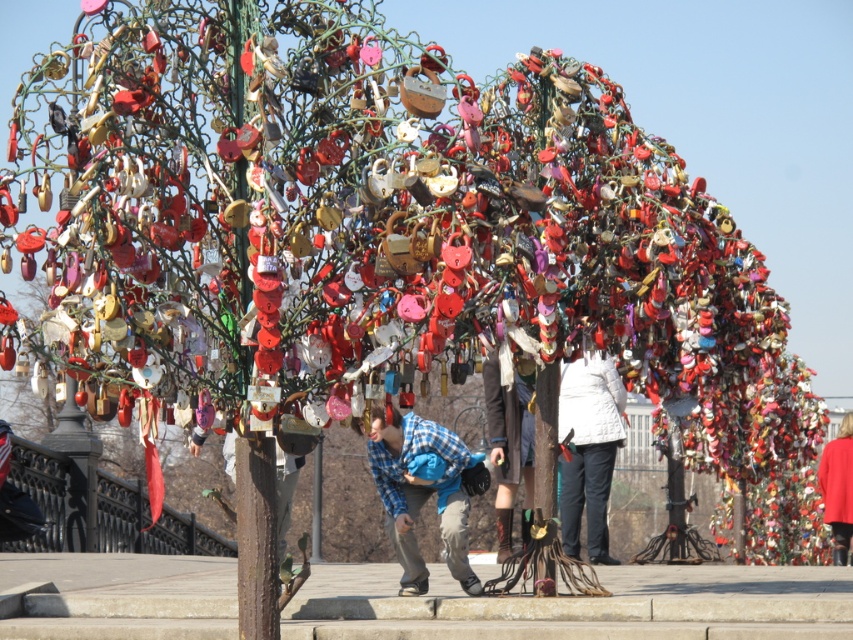
Can you confirm if blue plaid shirt at center is thinner than knitted sweater at center?

Correct, blue plaid shirt at center's width is less than knitted sweater at center's.

Who is lower down, blue plaid shirt at center or knitted sweater at center?

blue plaid shirt at center is lower down.

Is point (444, 472) farther from viewer compared to point (602, 545)?

No, (444, 472) is closer to viewer.

Identify the location of blue plaid shirt at center. Image resolution: width=853 pixels, height=640 pixels. (421, 492).

From the picture: Can you confirm if blue plaid shirt at center is positioned to the left of white matte jacket at center?

Indeed, blue plaid shirt at center is positioned on the left side of white matte jacket at center.

The width and height of the screenshot is (853, 640). I want to click on blue plaid shirt at center, so click(x=421, y=492).

How distant is knitted sweater at center from white matte jacket at center?

knitted sweater at center and white matte jacket at center are 14.89 inches apart from each other.

This screenshot has width=853, height=640. Describe the element at coordinates (589, 449) in the screenshot. I see `knitted sweater at center` at that location.

At what (x,y) coordinates should I click in order to perform the action: click on knitted sweater at center. Please return your answer as a coordinate pair (x, y). The height and width of the screenshot is (640, 853). Looking at the image, I should click on (589, 449).